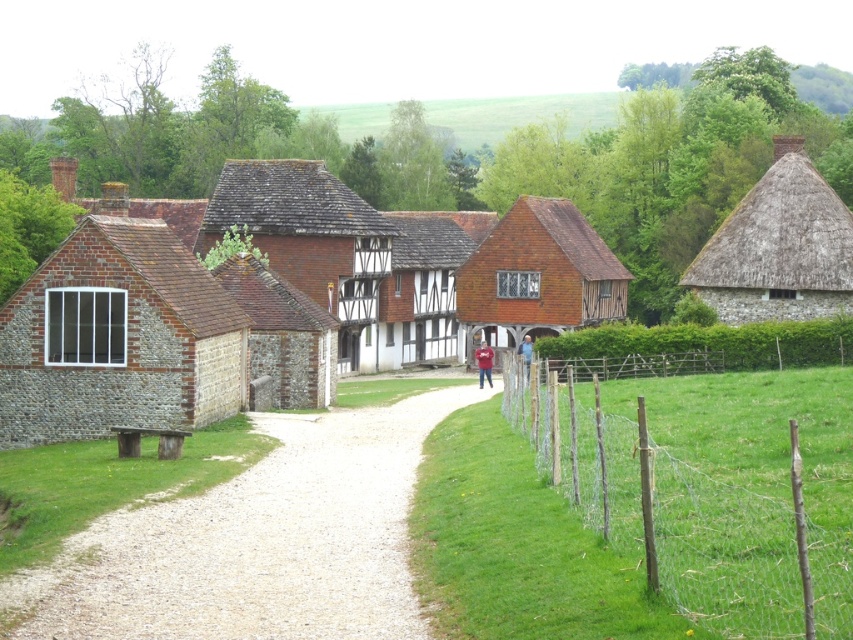
Question: Which point appears closest to the camera in this image?

Choices:
 (A) (198, 212)
 (B) (166, 513)
 (C) (527, 360)
 (D) (154, 291)

Answer: (B)

Question: Is brick stone cottage at left positioned at the back of blue denim jacket at center?

Choices:
 (A) no
 (B) yes

Answer: (A)

Question: Does brown wooden cottage at center appear under brick wall at center?

Choices:
 (A) no
 (B) yes

Answer: (A)

Question: Which point is farther from the camera taking this photo?

Choices:
 (A) (230, 289)
 (B) (523, 365)
 (C) (285, 588)

Answer: (A)

Question: Based on their relative distances, which object is nearer to the brown wooden cottage at center?

Choices:
 (A) brick stone cottage at left
 (B) thatched roof cottage at right
 (C) stone brick house at left
 (D) matte red shirt at center

Answer: (C)

Question: Does thatched roof cottage at right have a larger size compared to blue denim jacket at center?

Choices:
 (A) no
 (B) yes

Answer: (B)